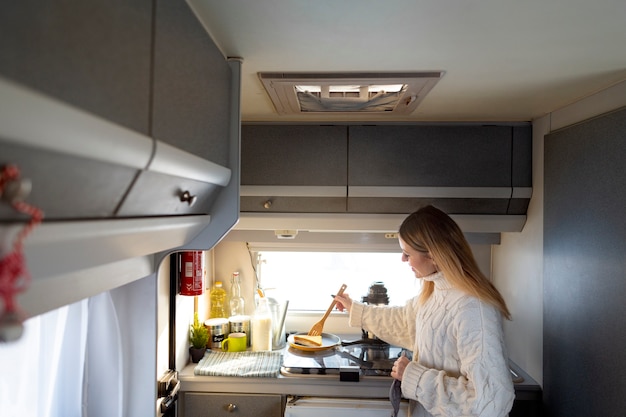
This screenshot has width=626, height=417. I want to click on towel, so (249, 370).